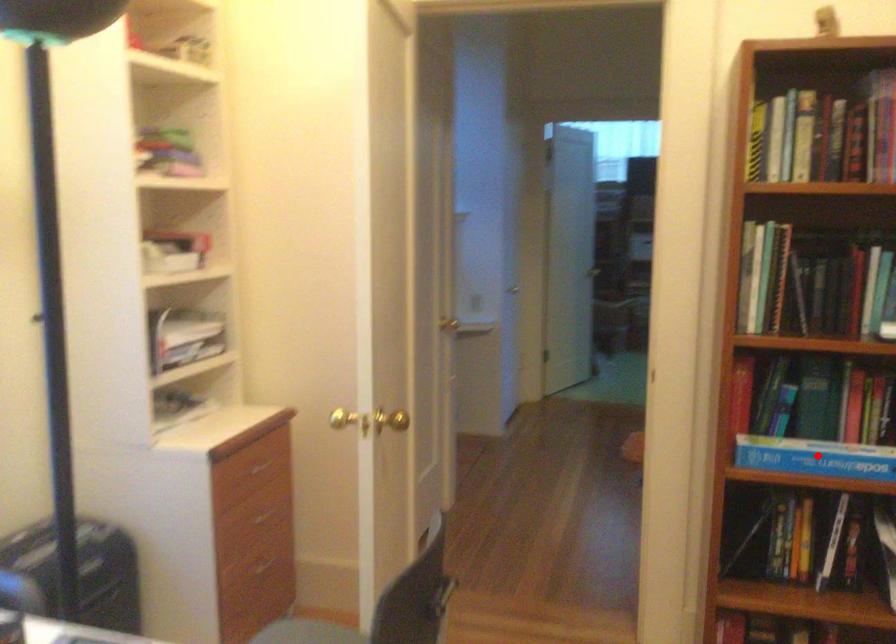
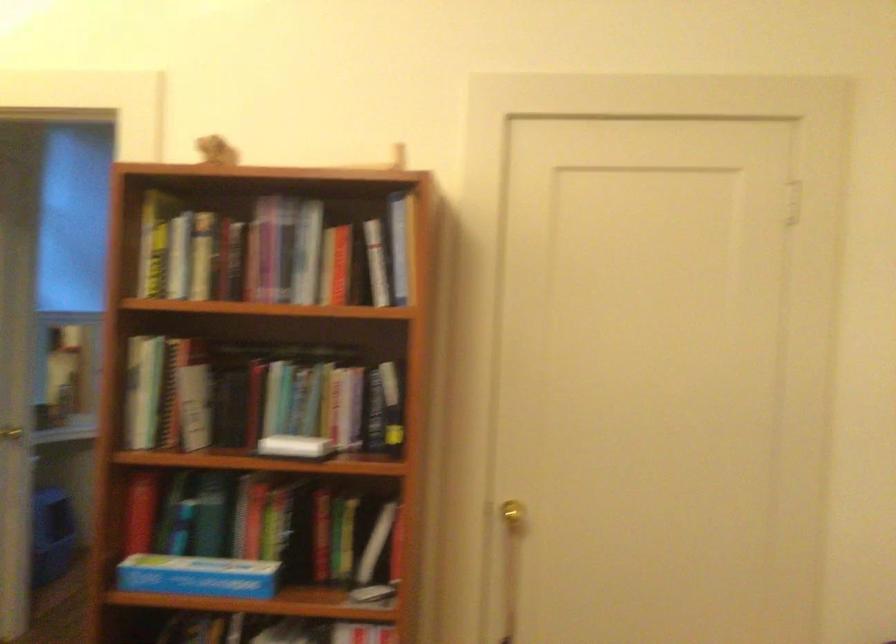
Where in the second image is the point corresponding to the highlighted location from the first image?

(197, 576)